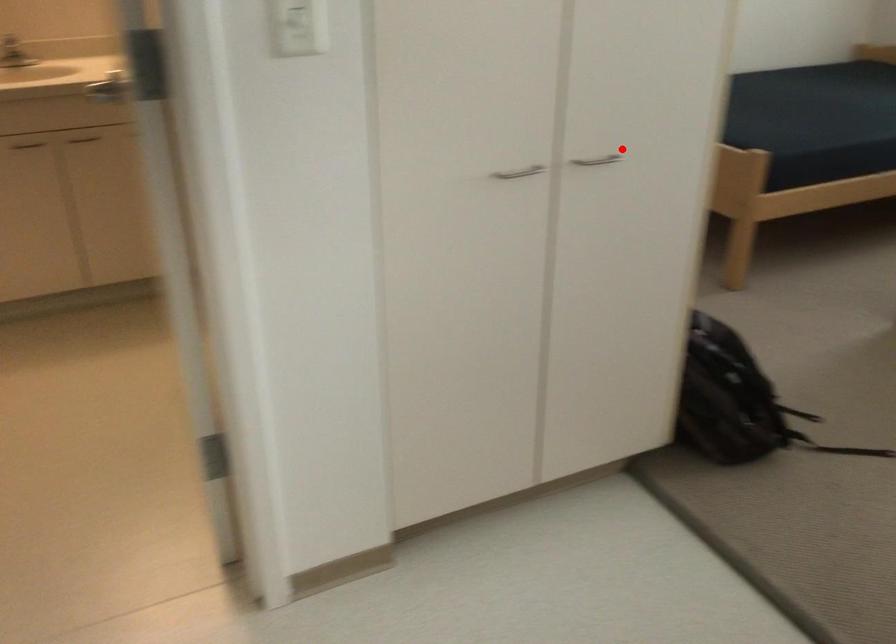
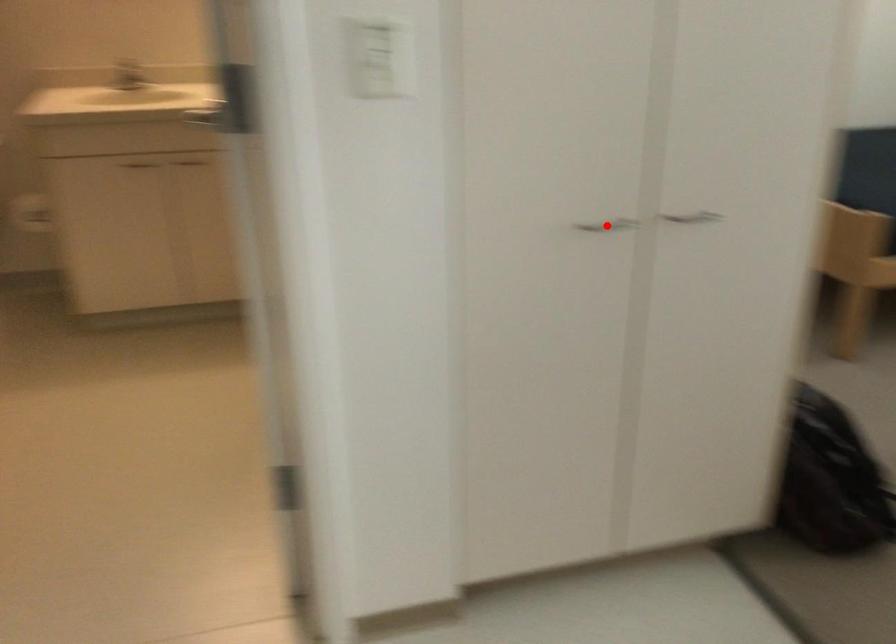
I am providing you with two images of the same scene from different viewpoints. A red point is marked on the first image and another point is marked on the second image. Do the highlighted points in image1 and image2 indicate the same real-world spot?

No